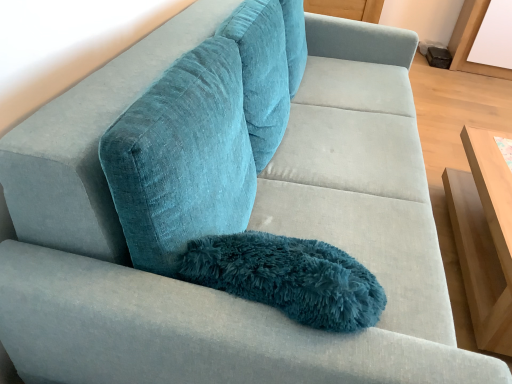
What do you see at coordinates (484, 236) in the screenshot?
I see `light brown wooden table at right` at bounding box center [484, 236].

The width and height of the screenshot is (512, 384). I want to click on light brown wooden table at right, so click(x=484, y=236).

Measure the distance between point (475, 206) and camera.

Point (475, 206) and camera are 6.24 feet apart.

Identify the location of light brown wooden table at right. (484, 236).